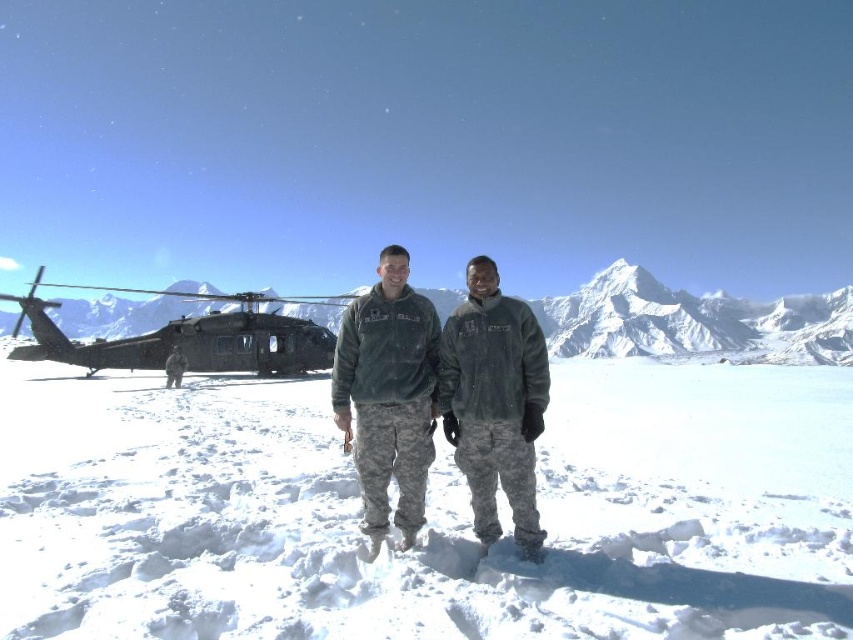
Between point (498, 305) and point (167, 362), which one is positioned behind?

Point (167, 362)

From the picture: Is green matte jacket at center to the right of camouflage uniform at center from the viewer's perspective?

Indeed, green matte jacket at center is positioned on the right side of camouflage uniform at center.

Which is behind, point (438, 381) or point (173, 365)?

Positioned behind is point (173, 365).

Locate an element on the screen. This screenshot has width=853, height=640. green matte jacket at center is located at coordinates (436, 396).

What do you see at coordinates (187, 339) in the screenshot? Image resolution: width=853 pixels, height=640 pixels. I see `dark gray matte helicopter at center-left` at bounding box center [187, 339].

Does point (274, 339) come closer to viewer compared to point (180, 385)?

No, it is not.

At what (x,y) coordinates should I click in order to perform the action: click on dark gray matte helicopter at center-left. Please return your answer as a coordinate pair (x, y). This screenshot has width=853, height=640. Looking at the image, I should click on (187, 339).

Is white powdery snow at center to the left of snowy white mountain at center from the viewer's perspective?

No, white powdery snow at center is not to the left of snowy white mountain at center.

The image size is (853, 640). Describe the element at coordinates (426, 513) in the screenshot. I see `white powdery snow at center` at that location.

In order to click on white powdery snow at center in this screenshot , I will do `click(426, 513)`.